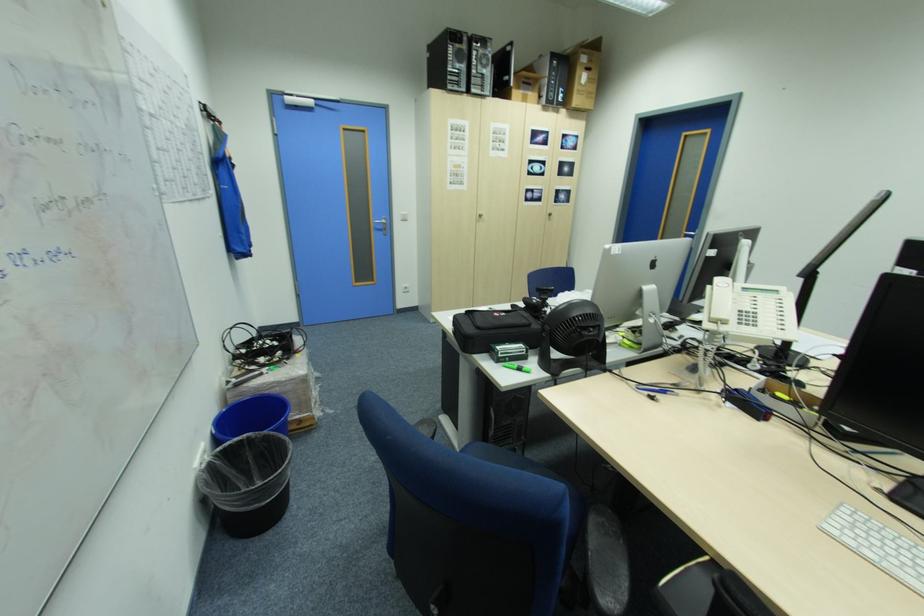
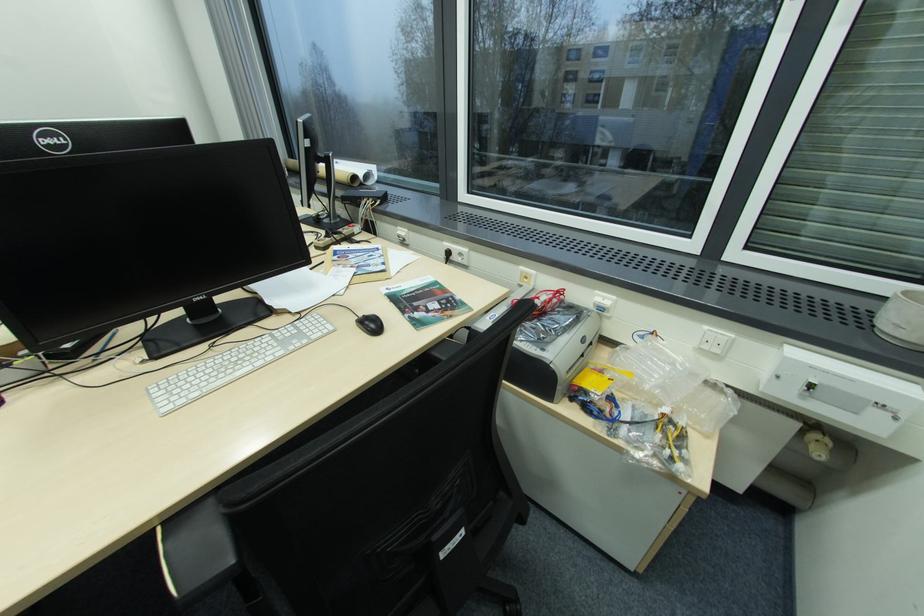
The point at (845,528) is marked in the first image. Where is the corresponding point in the second image?

(172, 403)